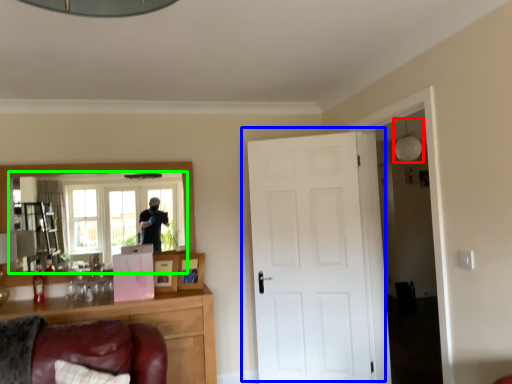
Question: Which object is the farthest from light fixture (highlighted by a red box)? Choose among these: door (highlighted by a blue box) or mirror (highlighted by a green box).

Choices:
 (A) door
 (B) mirror

Answer: (B)